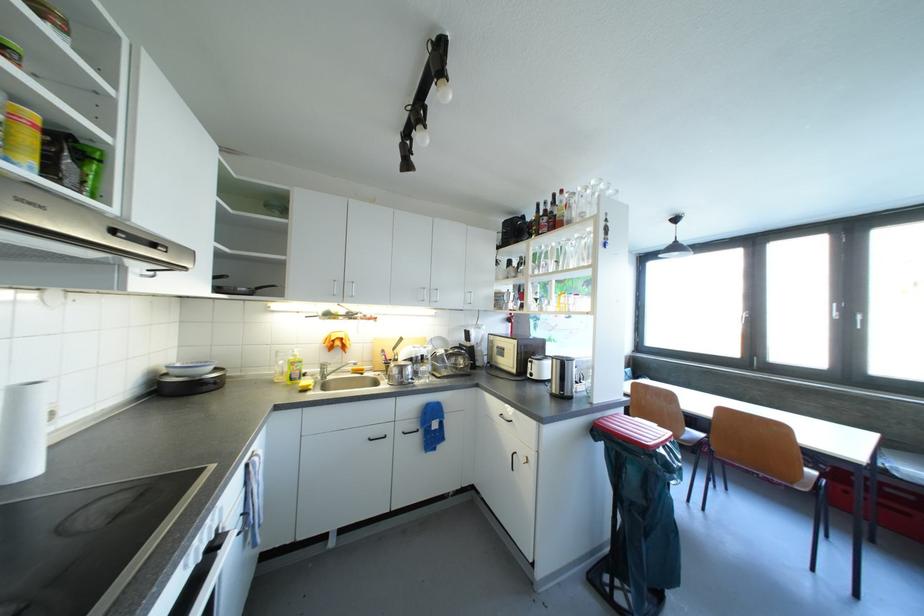
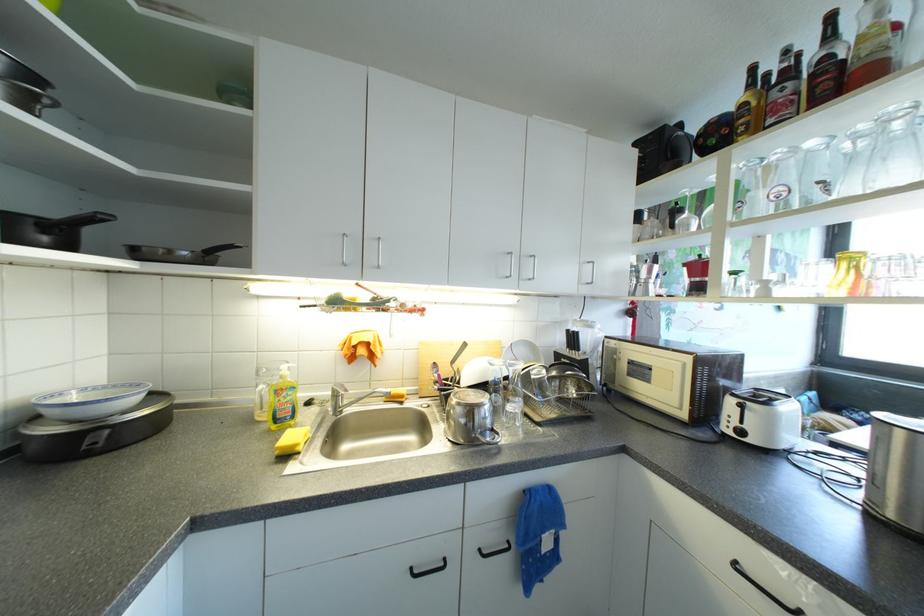
Question: The images are taken continuously from a first-person perspective. In which direction is your viewpoint rotating?

Choices:
 (A) Left
 (B) Right
 (C) Up
 (D) Down

Answer: (A)